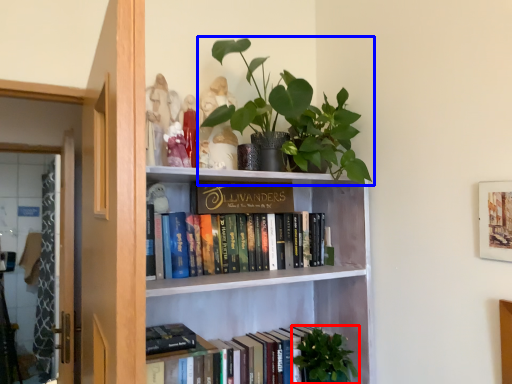
Question: Which object is closer to the camera taking this photo, vegetation (highlighted by a red box) or houseplant (highlighted by a blue box)?

Choices:
 (A) vegetation
 (B) houseplant

Answer: (B)